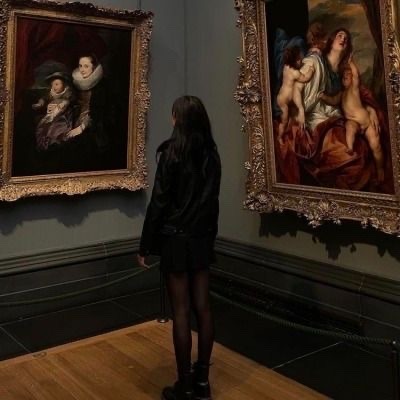
You are a GUI agent. You are given a task and a screenshot of the screen. Output one action in this format:
    pyautogui.click(x=<x>, y=<y>)
    Task: Click on the brown wood floor
    Image resolution: width=400 pixels, height=400 pixels.
    Given the screenshot: What is the action you would take?
    (x=93, y=369)